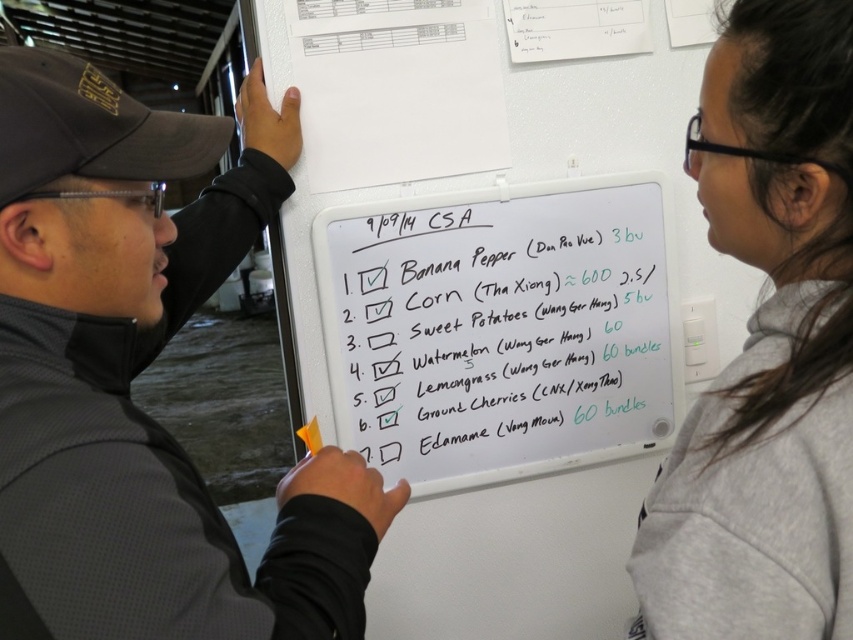
You are a farmer organizing CSA orders. You need to check an item on the whiteboard. The gray fleece sweatshirt at upper right and orange matte highlighter at center are both in your view. Which object can you use to mark the checked items on the whiteboard?

The orange matte highlighter at center can be used to mark the checked items on the whiteboard since it is a writing tool, while the gray fleece sweatshirt at upper right is a clothing item and not suitable for writing.

You are a farmer standing 20 inches away from the whiteboard. You want to reach the black matte jacket at left to hand over the CSA order list. Can you reach it without moving closer?

The black matte jacket at left is 20.83 inches away from the viewer, so you are currently 20 inches away. Since you are slightly closer than the jacket, you can reach it without moving closer.

You are trying to locate the orange matte highlighter at center and the gray fleece sweatshirt at upper right in the image. Which object is positioned more to the right?

The gray fleece sweatshirt at upper right is positioned more to the right than the orange matte highlighter at center.